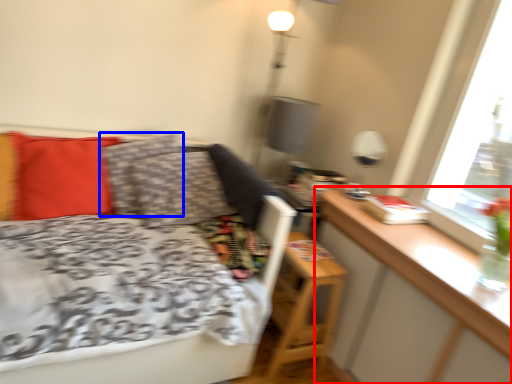
Question: Which object appears closest to the camera in this image, table (highlighted by a red box) or pillow (highlighted by a blue box)?

Choices:
 (A) table
 (B) pillow

Answer: (A)